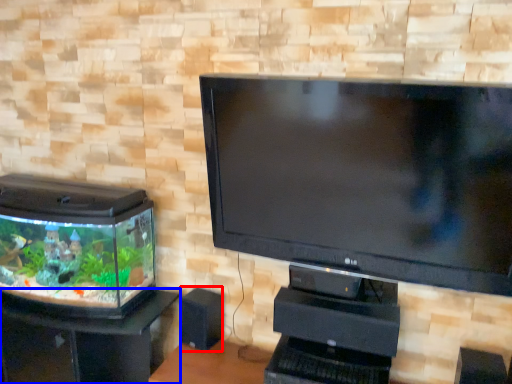
Question: Which object is further to the camera taking this photo, speaker (highlighted by a red box) or furniture (highlighted by a blue box)?

Choices:
 (A) speaker
 (B) furniture

Answer: (A)